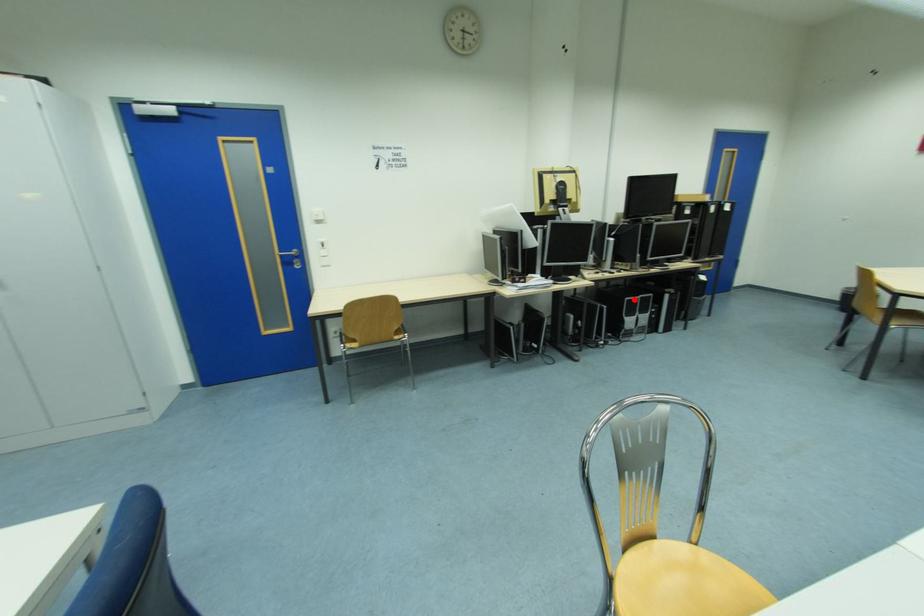
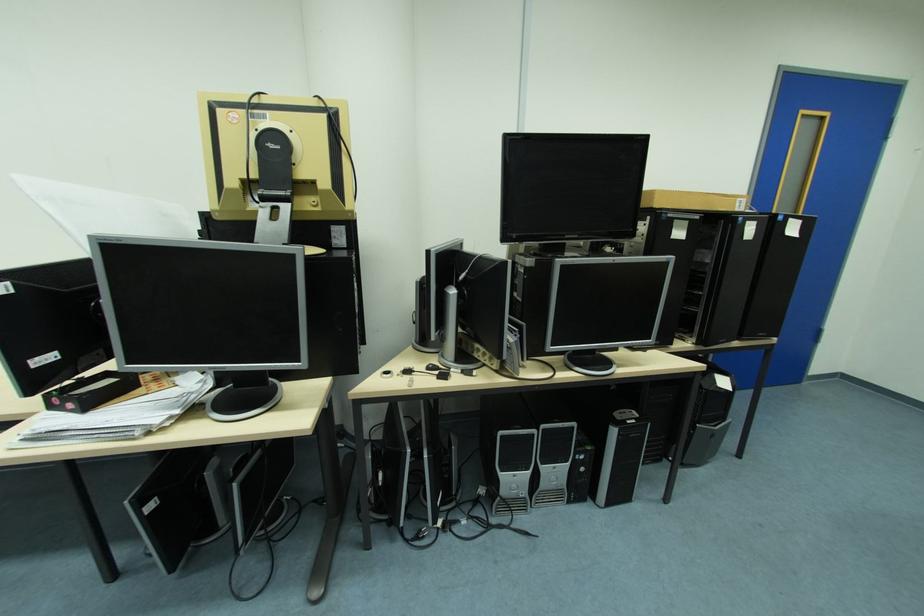
In the second image, find the point that corresponds to the highlighted location in the first image.

(507, 434)